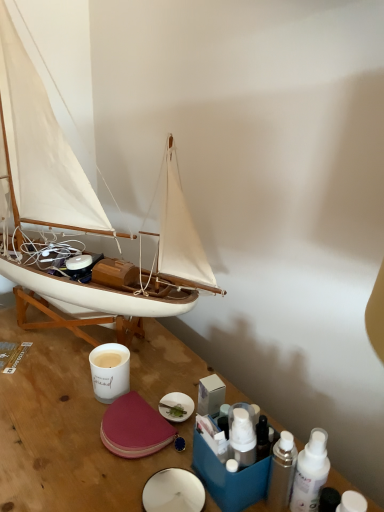
Identify the location of empty space that is to the right of white matte cup at center. (170, 386).